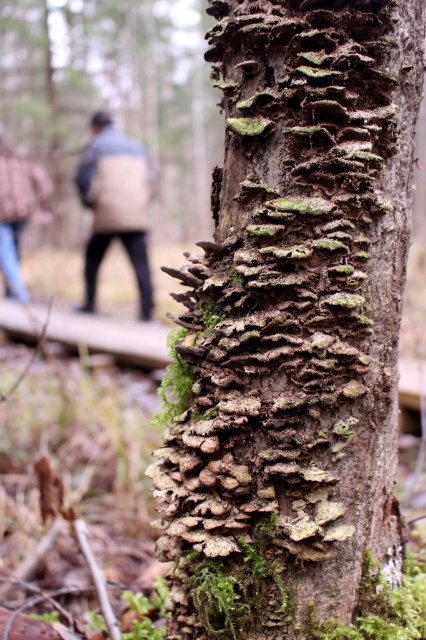
Between green mossy bark at center and beige wool coat at left, which one is positioned higher?

beige wool coat at left

Is green mossy bark at center taller than beige wool coat at left?

No, green mossy bark at center is not taller than beige wool coat at left.

Where is `green mossy bark at center`? green mossy bark at center is located at coordinates (293, 321).

You are a GUI agent. You are given a task and a screenshot of the screen. Output one action in this format:
    pyautogui.click(x=<x>, y=<y>)
    Task: Click on the beige wool coat at left
    Image resolution: width=426 pixels, height=640 pixels.
    Given the screenshot: What is the action you would take?
    pyautogui.click(x=115, y=204)

Consider the image. Which is more to the left, beige wool coat at left or blue jeans at lower left?

blue jeans at lower left is more to the left.

Between point (126, 145) and point (6, 260), which one is positioned behind?

The point (126, 145) is more distant.

Image resolution: width=426 pixels, height=640 pixels. In order to click on beige wool coat at left in this screenshot , I will do `click(115, 204)`.

Between green mossy bark at center and blue jeans at lower left, which one appears on the left side from the viewer's perspective?

From the viewer's perspective, blue jeans at lower left appears more on the left side.

Does green mossy bark at center lie behind blue jeans at lower left?

No.

Measure the distance between point (342, 540) and camera.

Point (342, 540) is 1.33 meters away from camera.

The width and height of the screenshot is (426, 640). What are the coordinates of `green mossy bark at center` in the screenshot? It's located at (293, 321).